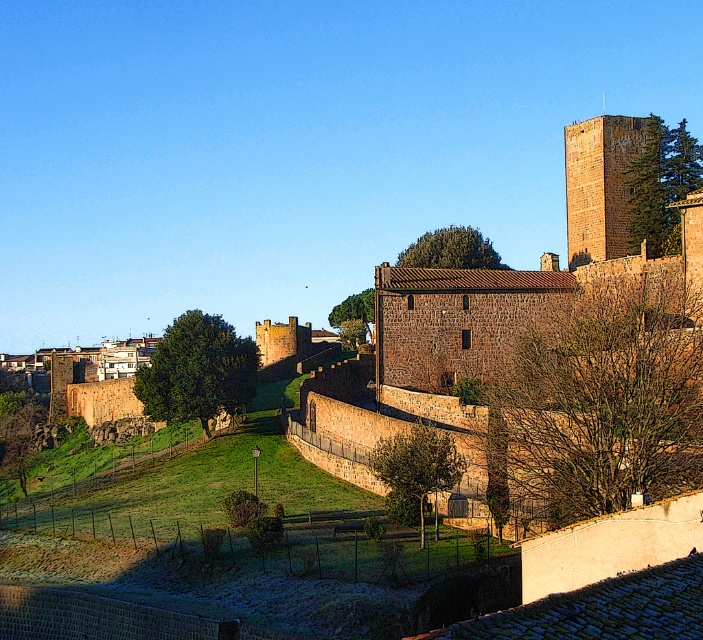
Is point (626, 304) positioned before point (586, 228)?

Yes, point (626, 304) is in front of point (586, 228).

Is point (652, 342) behind point (583, 145)?

No, (652, 342) is closer to viewer.

Does point (340, 433) come farther from viewer compared to point (631, 209)?

No, (340, 433) is closer to viewer.

Where is `brown stone castle at center`? The image size is (703, 640). brown stone castle at center is located at coordinates (543, 353).